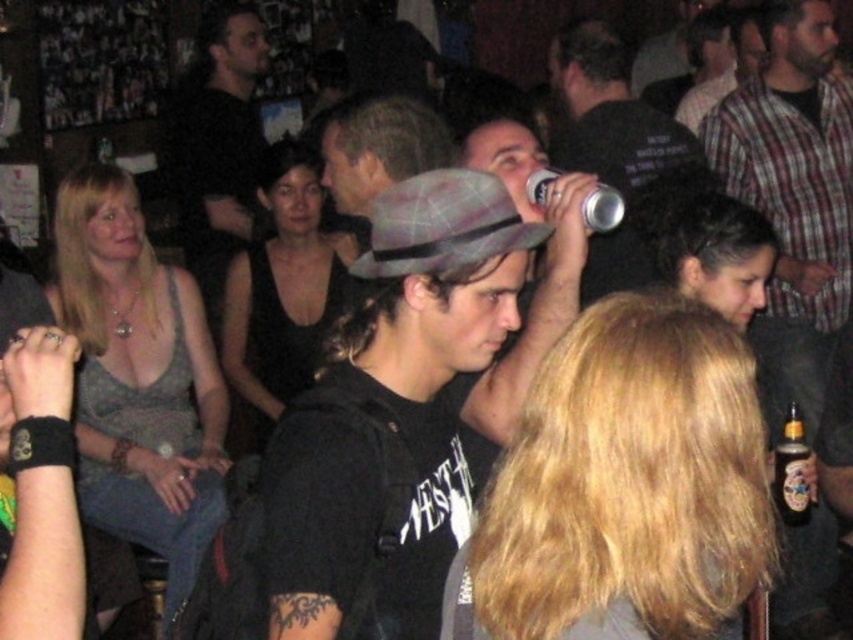
Looking at this image, between black matte shirt at upper center and silver metallic can at upper center, which one has more height?

black matte shirt at upper center

Can you confirm if black matte shirt at upper center is bigger than silver metallic can at upper center?

Indeed, black matte shirt at upper center has a larger size compared to silver metallic can at upper center.

Between point (236, 200) and point (599, 195), which one is positioned in front?

Positioned in front is point (599, 195).

Find the location of a particular element. black matte shirt at upper center is located at coordinates (218, 141).

Does black matte shirt at upper center have a smaller size compared to metallic silver can at upper center?

No, black matte shirt at upper center is not smaller than metallic silver can at upper center.

Is black matte shirt at upper center shorter than metallic silver can at upper center?

No.

Does point (193, 260) come farther from viewer compared to point (688, 154)?

Yes, it is.

The height and width of the screenshot is (640, 853). Identify the location of black matte shirt at upper center. (218, 141).

Can you confirm if plaid fabric fedora at center is positioned to the left of amber glass bottle at lower right?

Correct, you'll find plaid fabric fedora at center to the left of amber glass bottle at lower right.

Between plaid fabric fedora at center and amber glass bottle at lower right, which one has less height?

With less height is amber glass bottle at lower right.

Does point (286, 616) come in front of point (790, 522)?

Yes, it is.

Identify the location of plaid fabric fedora at center. (432, 352).